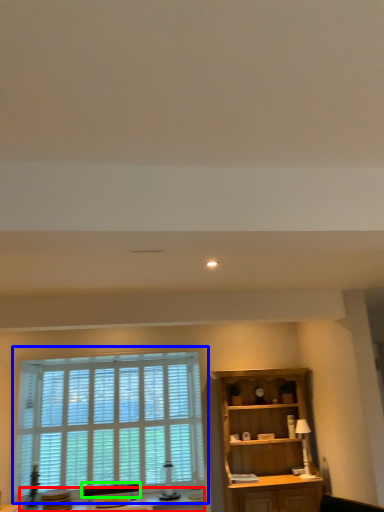
Question: Estimate the real-world distances between objects in this image. Which object is farther from table (highlighted by a red box), window (highlighted by a blue box) or swivel chair (highlighted by a green box)?

Choices:
 (A) window
 (B) swivel chair

Answer: (A)